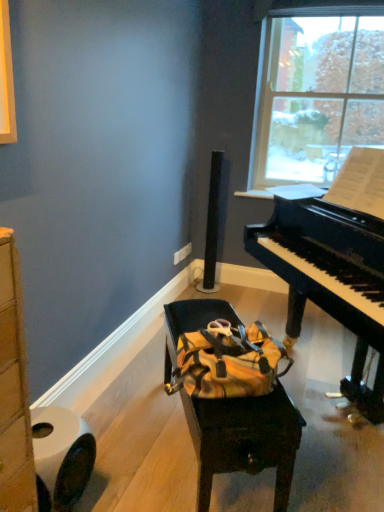
I want to click on vacant space to the left of yellow fabric bag at center, so click(x=134, y=435).